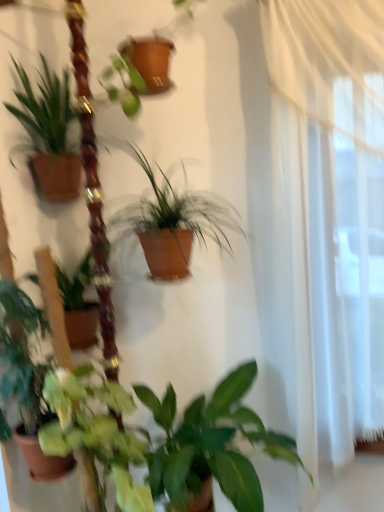
Question: From a real-world perspective, is green matte plant at left, which is the second houseplant in bottom-to-top order, below green matte leafy plant at lower center?

Choices:
 (A) yes
 (B) no

Answer: (B)

Question: Does green matte plant at left, the third houseplant from the top, have a larger size compared to green matte leafy plant at lower center?

Choices:
 (A) no
 (B) yes

Answer: (A)

Question: Is green matte plant at left, the third houseplant from the top, closer to camera compared to green matte leafy plant at lower center?

Choices:
 (A) yes
 (B) no

Answer: (B)

Question: Is green matte leafy plant at lower center at the back of green matte plant at left, which is the second houseplant in bottom-to-top order?

Choices:
 (A) no
 (B) yes

Answer: (A)

Question: Can you confirm if green matte plant at left, the third houseplant from the top, is thinner than green matte leafy plant at lower center?

Choices:
 (A) yes
 (B) no

Answer: (A)

Question: Considering the relative positions of green matte plant at left, which is the second houseplant in bottom-to-top order, and green matte leafy plant at lower center in the image provided, is green matte plant at left, which is the second houseplant in bottom-to-top order, to the right of green matte leafy plant at lower center from the viewer's perspective?

Choices:
 (A) no
 (B) yes

Answer: (A)

Question: Is green matte leafy plant at lower center oriented away from green matte plant at left, which is the second houseplant in bottom-to-top order?

Choices:
 (A) yes
 (B) no

Answer: (B)

Question: Can you confirm if green matte leafy plant at lower center is shorter than green matte plant at left, which is the second houseplant in bottom-to-top order?

Choices:
 (A) yes
 (B) no

Answer: (A)

Question: From a real-world perspective, is green matte leafy plant at lower center under green matte plant at left, which is the second houseplant in bottom-to-top order?

Choices:
 (A) no
 (B) yes

Answer: (B)

Question: Is green matte leafy plant at lower center not near green matte plant at left, the third houseplant from the top?

Choices:
 (A) yes
 (B) no

Answer: (B)

Question: Are green matte leafy plant at lower center and green matte plant at left, the third houseplant from the top, beside each other?

Choices:
 (A) no
 (B) yes

Answer: (A)

Question: Is green matte leafy plant at lower center to the left of green matte plant at left, the third houseplant from the top, from the viewer's perspective?

Choices:
 (A) no
 (B) yes

Answer: (A)

Question: Can you confirm if green matte leafy plant at lower center is thinner than green matte plant at lower center, placed as the fourth houseplant when sorted from top to bottom?

Choices:
 (A) no
 (B) yes

Answer: (B)